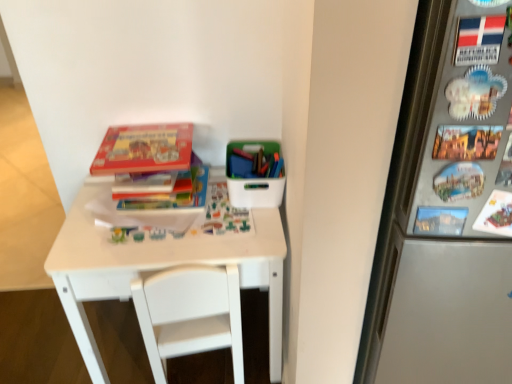
The height and width of the screenshot is (384, 512). Find the location of `vacant space situated above white matte table at center (from a real-world perspective)`. vacant space situated above white matte table at center (from a real-world perspective) is located at coordinates (164, 220).